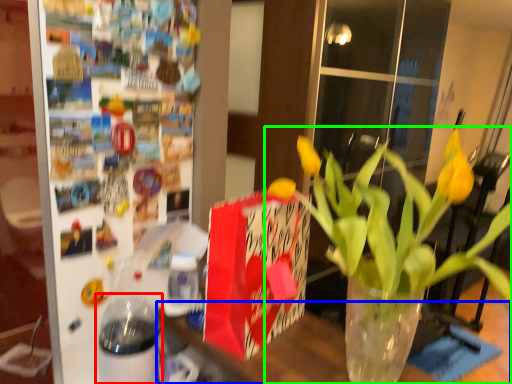
Question: Which object is positioned farthest from glass jar (highlighted by a red box)? Select from table (highlighted by a blue box) and houseplant (highlighted by a green box).

Choices:
 (A) table
 (B) houseplant

Answer: (A)